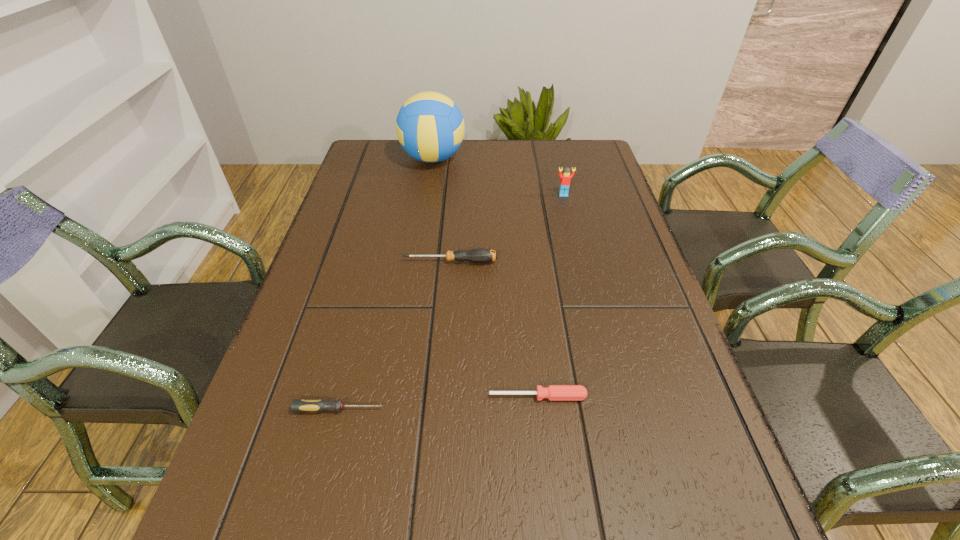
Locate an element on the screen. vacant space located 0.070m on the left of the farthest screwdriver is located at coordinates (375, 261).

Where is `vacant space located 0.190m on the right of the second farthest screwdriver`? This screenshot has width=960, height=540. vacant space located 0.190m on the right of the second farthest screwdriver is located at coordinates (688, 396).

Find the location of a particular element. Image resolution: width=960 pixels, height=540 pixels. free space located 0.290m insert the nearest screwdriver into a screw head is located at coordinates (543, 409).

At what (x,y) coordinates should I click in order to perform the action: click on object that is at the far edge. Please return your answer as a coordinate pair (x, y). Looking at the image, I should click on (430, 127).

Locate an element on the screen. volleyball that is at the left edge is located at coordinates (430, 127).

Identify the location of screwdriver that is at the left edge. The image size is (960, 540). (298, 405).

Find the location of a particular element. object at the right edge is located at coordinates (565, 177).

The width and height of the screenshot is (960, 540). I want to click on object positioned at the far left corner, so click(x=430, y=127).

In the image, there is a desktop. At what (x,y) coordinates should I click in order to perform the action: click on free space at the far edge. Please return your answer as a coordinate pair (x, y). Looking at the image, I should click on (546, 159).

In the image, there is a desktop. In order to click on vacant region at the left edge in this screenshot , I will do `click(357, 183)`.